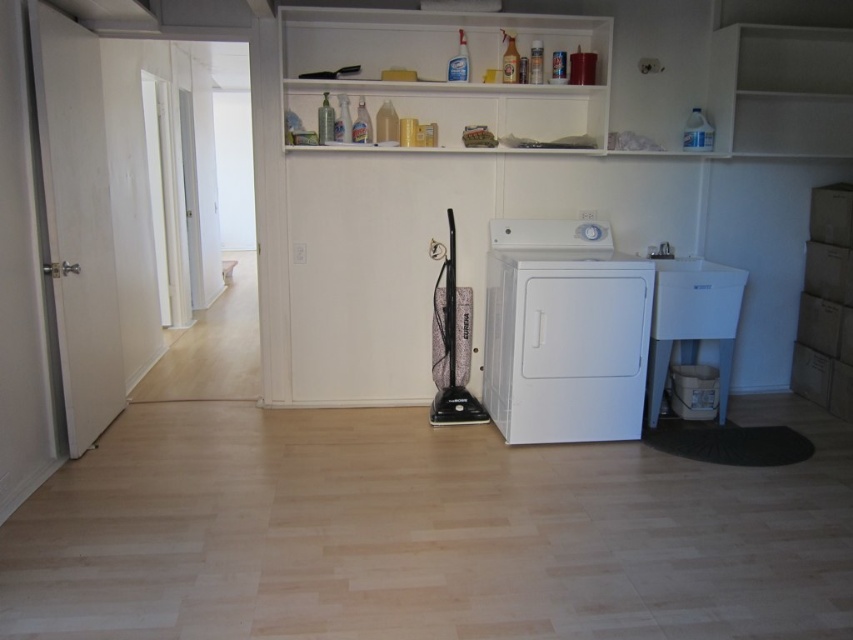
Question: Considering the relative positions of white matte washing machine at center and white matte shelf at upper center in the image provided, where is white matte washing machine at center located with respect to white matte shelf at upper center?

Choices:
 (A) left
 (B) right

Answer: (B)

Question: Is white matte washing machine at center bigger than white matte shelf at upper center?

Choices:
 (A) yes
 (B) no

Answer: (A)

Question: Is white matte washing machine at center below white matte shelf at upper center?

Choices:
 (A) no
 (B) yes

Answer: (B)

Question: Which of the following is the farthest from the observer?

Choices:
 (A) (636, 436)
 (B) (428, 32)

Answer: (B)